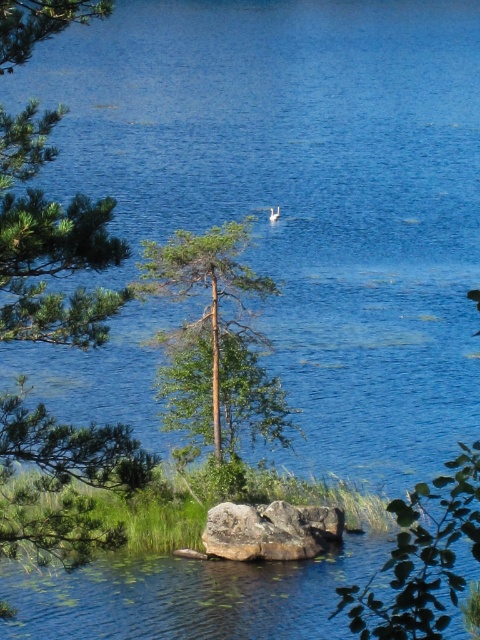
Question: Can you confirm if green leafy tree at left is wider than brown rough rock at center?

Choices:
 (A) yes
 (B) no

Answer: (A)

Question: Can you confirm if green leafy tree at left is positioned to the left of green leafy tree at center?

Choices:
 (A) yes
 (B) no

Answer: (A)

Question: Which object is positioned closest to the green leafy tree at center?

Choices:
 (A) brown rough rock at center
 (B) green leafy tree at left

Answer: (A)

Question: Is green leafy tree at center positioned in front of brown rough rock at center?

Choices:
 (A) no
 (B) yes

Answer: (A)

Question: Which object is the closest to the green leafy tree at center?

Choices:
 (A) green leafy tree at left
 (B) brown rough rock at center

Answer: (B)

Question: Which of the following is the farthest from the observer?

Choices:
 (A) (21, 200)
 (B) (175, 340)

Answer: (B)